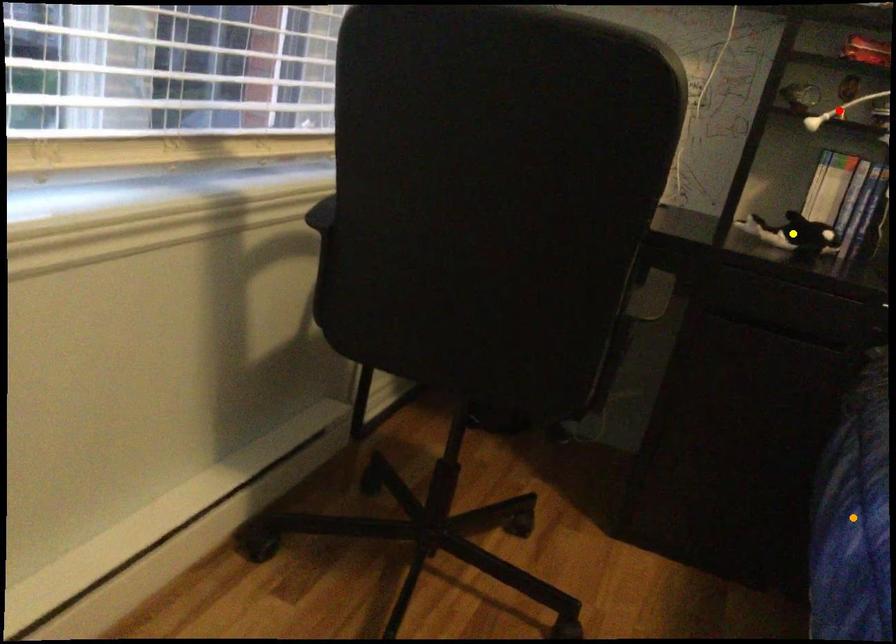
Looking at this image, order these from nearest to farthest:
1. orange point
2. yellow point
3. red point

orange point < yellow point < red point